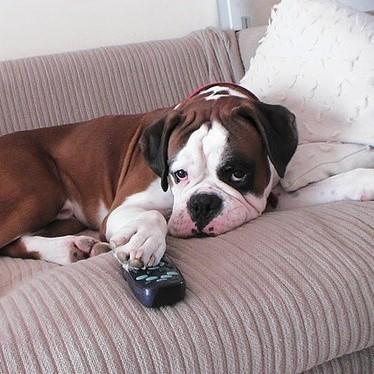
In order to click on black and grey remote on couch in this screenshot , I will do [162, 283].